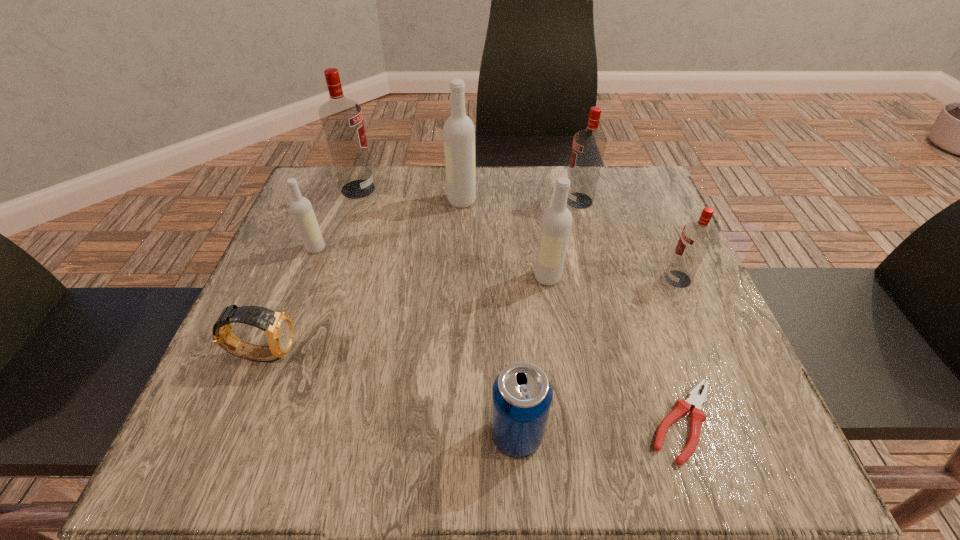
I want to click on pliers present at the near edge, so click(697, 415).

The height and width of the screenshot is (540, 960). Identify the location of watch that is at the left edge. (278, 327).

This screenshot has height=540, width=960. Identify the location of vodka at the right edge. (696, 237).

Identify the location of pliers at the right edge. The height and width of the screenshot is (540, 960). (697, 415).

Find the location of a particular element. The image size is (960, 540). object that is at the far left corner is located at coordinates (342, 121).

Identify the location of object that is at the near right corner. (697, 415).

In the image, there is a desktop. At what (x,y) coordinates should I click in order to perform the action: click on free space at the far edge. Please return your answer as a coordinate pair (x, y). The width and height of the screenshot is (960, 540). Looking at the image, I should click on (403, 170).

The width and height of the screenshot is (960, 540). In order to click on vacant space at the near edge of the desktop in this screenshot , I will do `click(369, 423)`.

This screenshot has width=960, height=540. What are the coordinates of `vacant space at the right edge` in the screenshot? It's located at (625, 248).

You are a GUI agent. You are given a task and a screenshot of the screen. Output one action in this format:
    pyautogui.click(x=<x>, y=<y>)
    Task: Click on the free space at the far left corner of the desktop
    The width and height of the screenshot is (960, 540).
    Given the screenshot: What is the action you would take?
    pyautogui.click(x=331, y=192)